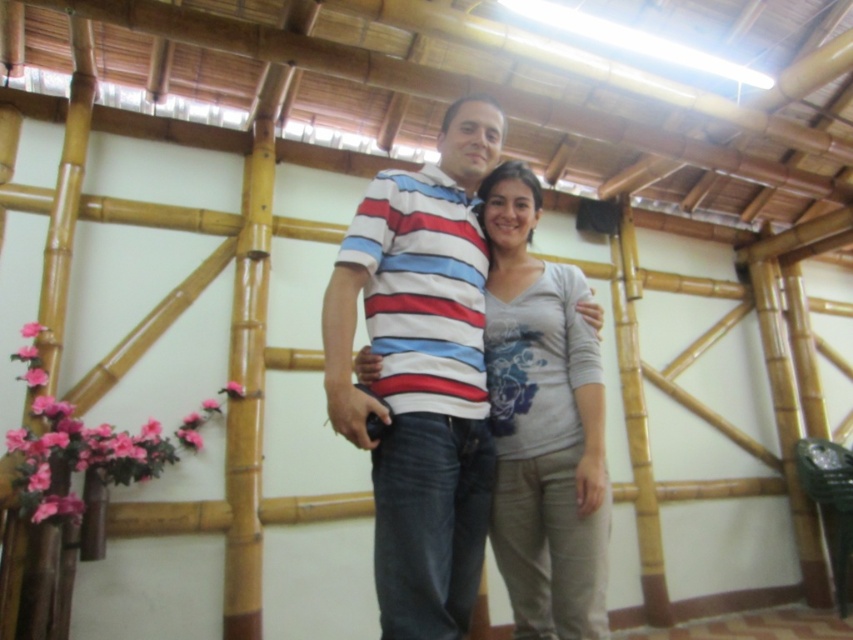
Question: Is striped cotton shirt at center to the right of gray cotton shirt at center from the viewer's perspective?

Choices:
 (A) yes
 (B) no

Answer: (B)

Question: Among these points, which one is farthest from the camera?

Choices:
 (A) (439, 465)
 (B) (589, 360)

Answer: (B)

Question: Which of the following is the closest to the observer?

Choices:
 (A) gray cotton shirt at center
 (B) striped cotton shirt at center

Answer: (B)

Question: From the image, what is the correct spatial relationship of striped cotton shirt at center in relation to gray cotton shirt at center?

Choices:
 (A) below
 (B) above

Answer: (B)

Question: Can you confirm if striped cotton shirt at center is positioned below gray cotton shirt at center?

Choices:
 (A) no
 (B) yes

Answer: (A)